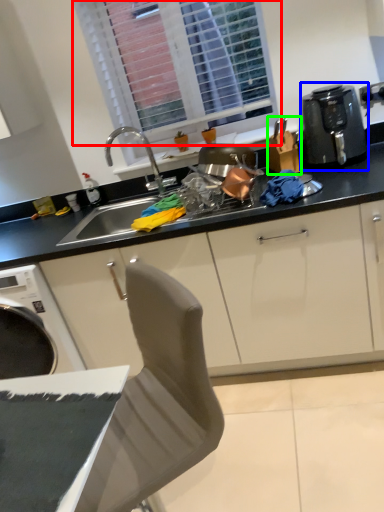
Question: Based on their relative distances, which object is farther from window (highlighted by a red box)? Choose from kitchen appliance (highlighted by a blue box) and appliance (highlighted by a green box).

Choices:
 (A) kitchen appliance
 (B) appliance

Answer: (A)